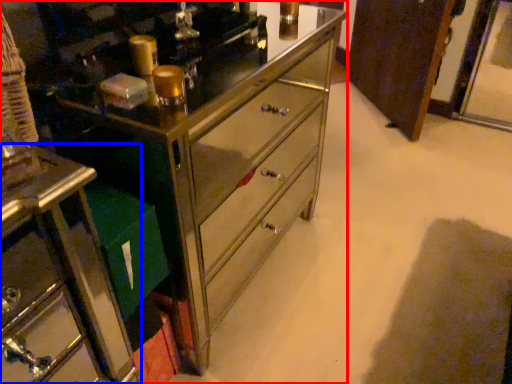
Question: Among these objects, which one is nearest to the camera, chest of drawers (highlighted by a red box) or furniture (highlighted by a blue box)?

Choices:
 (A) chest of drawers
 (B) furniture

Answer: (A)